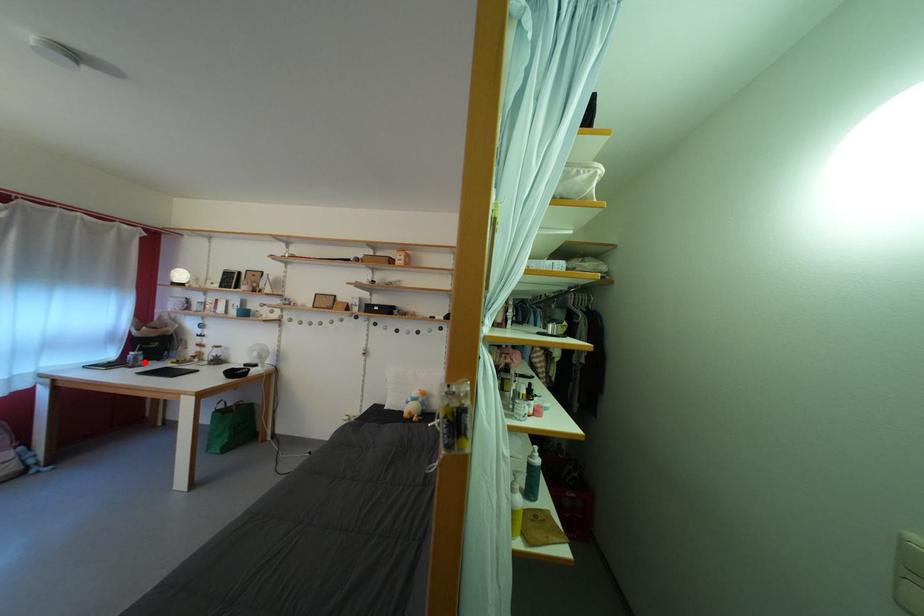
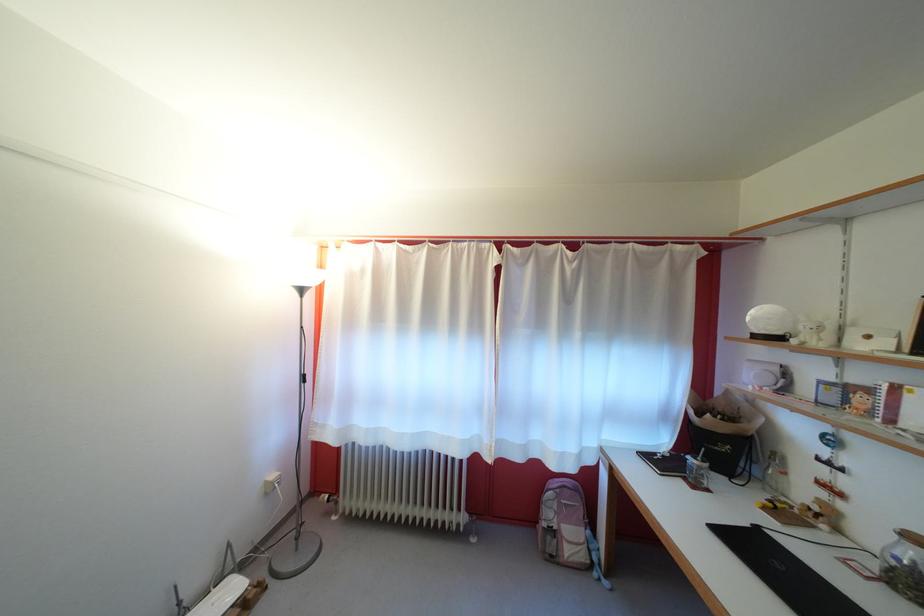
Find the pixel in the second image that matches the highlighted location in the first image.

(708, 474)